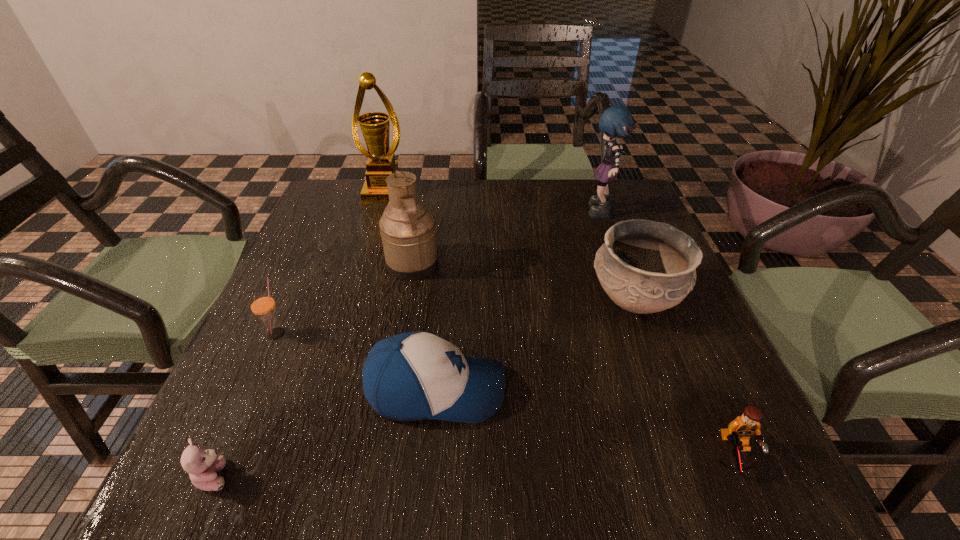
The height and width of the screenshot is (540, 960). What are the coordinates of `teddy bear located in the near edge section of the desktop` in the screenshot? It's located at (202, 465).

At what (x,y) coordinates should I click in order to perform the action: click on award that is at the left edge. Please return your answer as a coordinate pair (x, y). The height and width of the screenshot is (540, 960). Looking at the image, I should click on (381, 163).

This screenshot has width=960, height=540. I want to click on straw at the left edge, so click(x=262, y=304).

I want to click on teddy bear present at the left edge, so click(x=202, y=465).

I want to click on rag doll at the right edge, so click(616, 121).

The height and width of the screenshot is (540, 960). I want to click on pottery that is positioned at the right edge, so click(644, 266).

Where is `Lego at the right edge`? This screenshot has width=960, height=540. Lego at the right edge is located at coordinates 739,431.

Where is `object that is at the far left corner`? object that is at the far left corner is located at coordinates (381, 163).

Where is `object located at the near left corner`? object located at the near left corner is located at coordinates (202, 465).

Locate an element on the screen. object located in the far right corner section of the desktop is located at coordinates (616, 121).